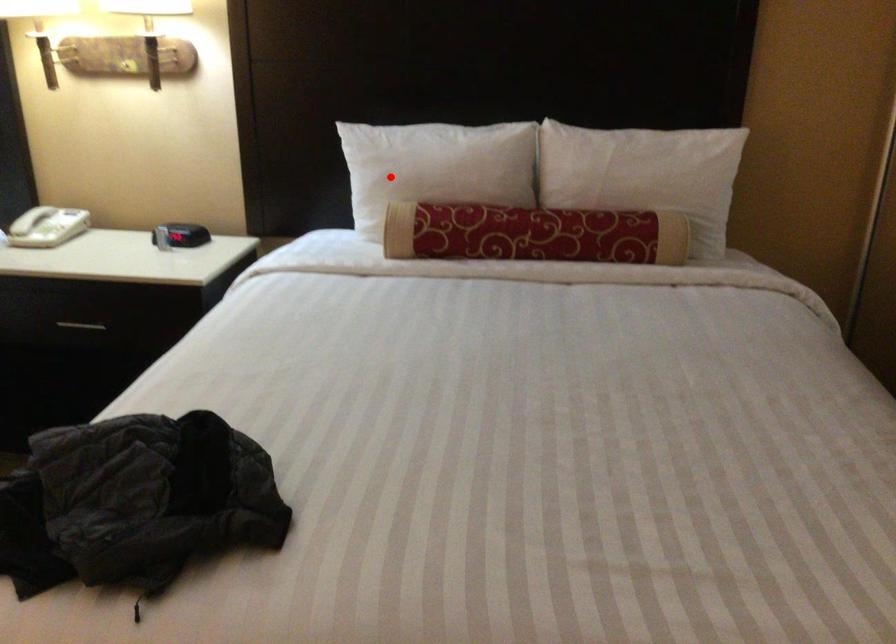
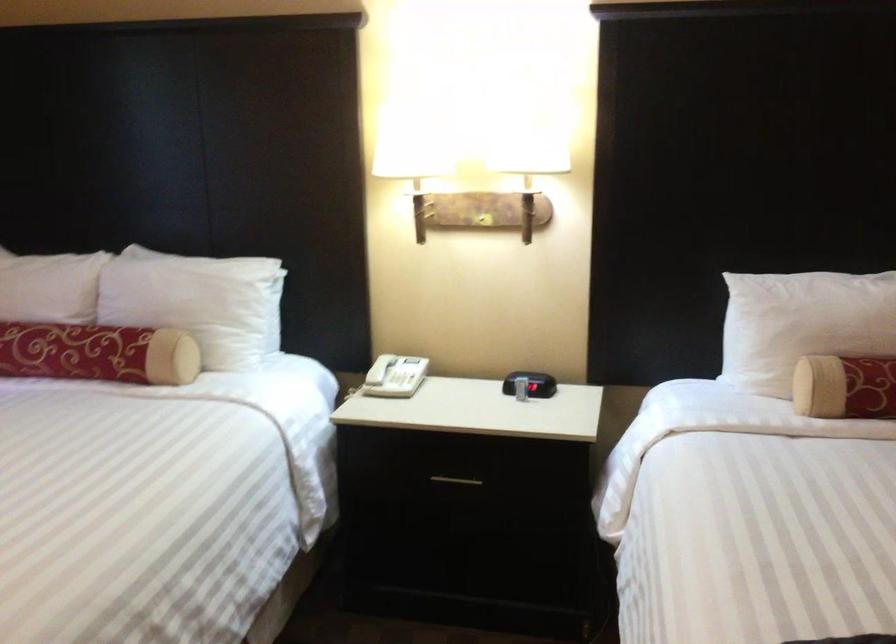
In the second image, find the point that corresponds to the highlighted location in the first image.

(802, 324)